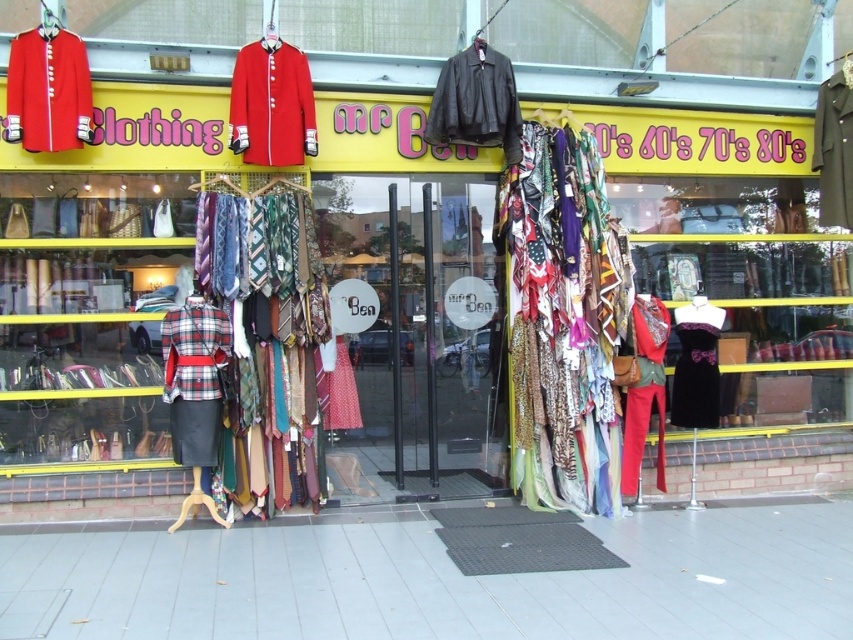
Is textured fabric tie at center thinner than velvet black dress at center?

No, textured fabric tie at center is not thinner than velvet black dress at center.

Is point (302, 380) in front of point (677, 371)?

Yes.

Is point (227, 264) farther from viewer compared to point (706, 342)?

No, it is in front of (706, 342).

The image size is (853, 640). In order to click on textured fabric tie at center in this screenshot , I will do `click(267, 278)`.

Between leather jacket at upper center and matte red pants at center, which one is positioned higher?

leather jacket at upper center is higher up.

In the scene shown: Can you confirm if leather jacket at upper center is smaller than matte red pants at center?

Incorrect, leather jacket at upper center is not smaller in size than matte red pants at center.

What do you see at coordinates (476, 102) in the screenshot?
I see `leather jacket at upper center` at bounding box center [476, 102].

At what (x,y) coordinates should I click in order to perform the action: click on leather jacket at upper center. Please return your answer as a coordinate pair (x, y). The width and height of the screenshot is (853, 640). Looking at the image, I should click on (476, 102).

Between point (292, 58) and point (19, 125), which one is positioned in front?

Point (19, 125) is in front.

Which of these two, matte red coat at center or matte red military coat at upper left, stands shorter?

Standing shorter between the two is matte red military coat at upper left.

Between point (286, 106) and point (80, 97), which one is positioned in front?

Point (80, 97) is in front.

This screenshot has height=640, width=853. Find the location of `matte red coat at center`. matte red coat at center is located at coordinates (271, 104).